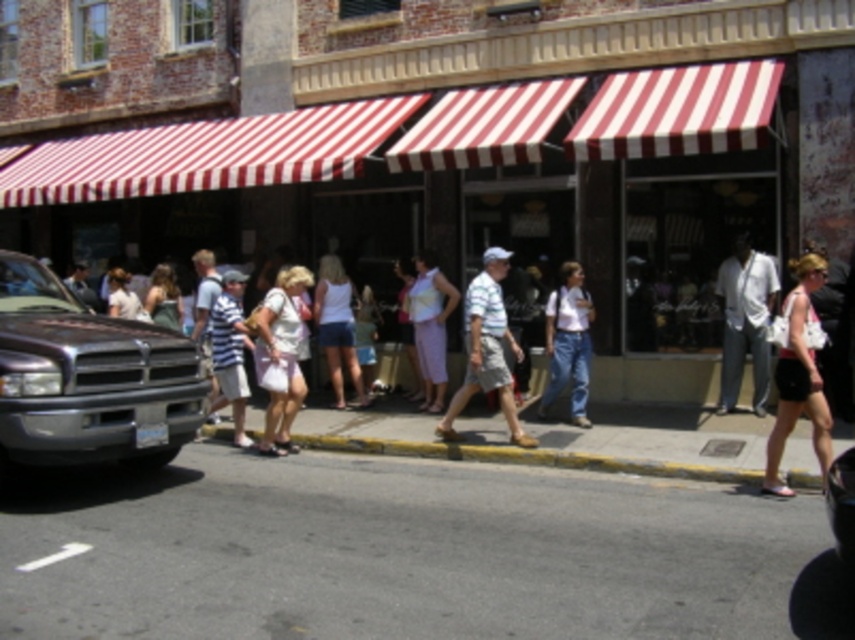
Question: Does white fabric shorts at right come in front of striped cotton shirt at center?

Choices:
 (A) yes
 (B) no

Answer: (A)

Question: Is white cotton shirt at right smaller than white cotton backpack at center?

Choices:
 (A) yes
 (B) no

Answer: (B)

Question: Does striped cotton shirt at center appear on the left side of striped fabric shorts at center?

Choices:
 (A) no
 (B) yes

Answer: (A)

Question: Which point is closer to the camera?

Choices:
 (A) shiny dark purple truck at left
 (B) white cotton tank top at center

Answer: (A)

Question: Which object is the closest to the striped cotton shirt at center?

Choices:
 (A) shiny black car at center
 (B) white cotton shirt at right

Answer: (B)

Question: Considering the real-world distances, which object is closest to the white cotton shirt at right?

Choices:
 (A) yellow painted curb at lower center
 (B) white fabric shorts at right
 (C) striped cotton shirt at center
 (D) white cotton tank top at center

Answer: (C)